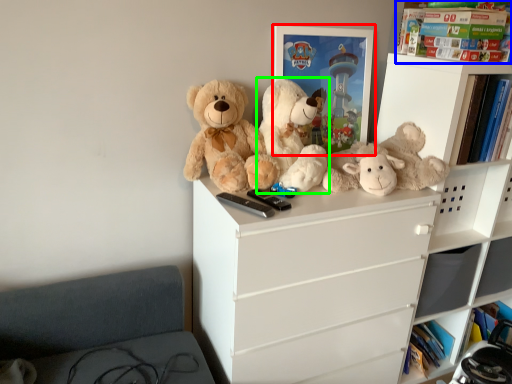
Question: Based on their relative distances, which object is farther from picture frame (highlighted by a red box)? Choose from book (highlighted by a blue box) and teddy bear (highlighted by a green box).

Choices:
 (A) book
 (B) teddy bear

Answer: (A)